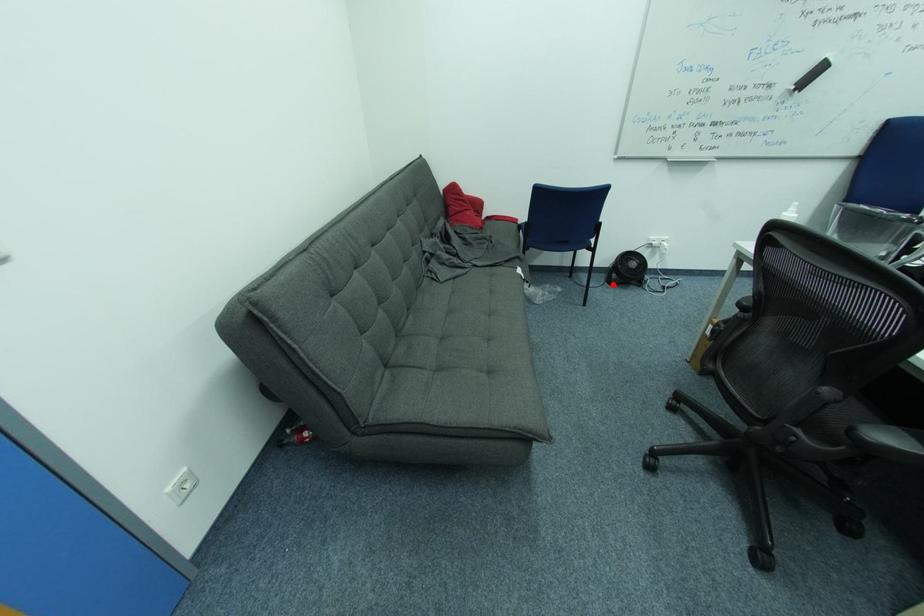
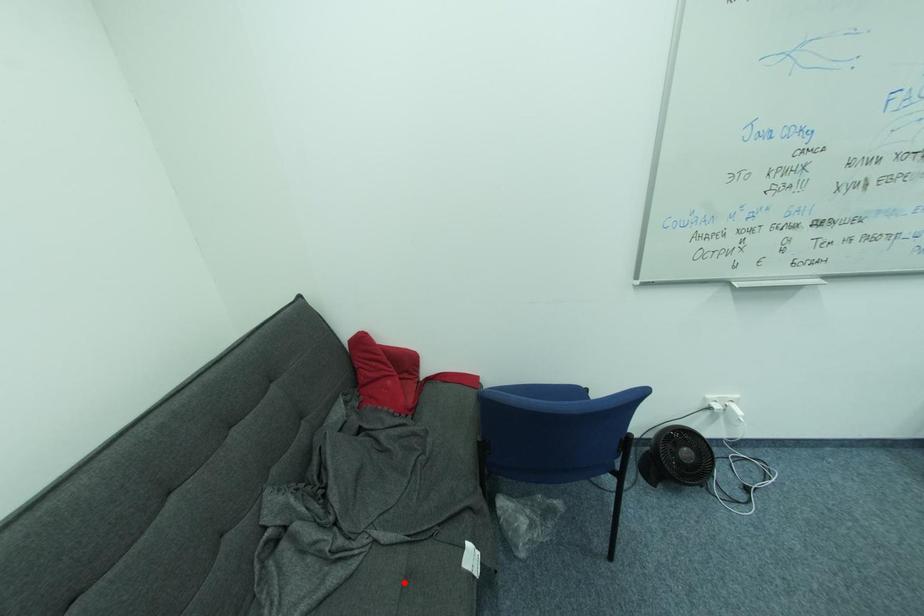
I am providing you with two images of the same scene from different viewpoints. A red point is marked on the first image and another point is marked on the second image. Does the point marked in image1 correspond to the same location as the one in image2?

No